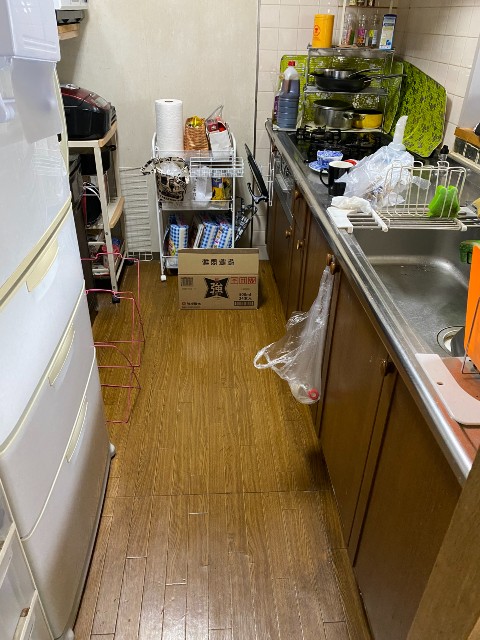
You are a GUI agent. You are given a task and a screenshot of the screen. Output one action in this format:
    pyautogui.click(x=<x>, y=<y>)
    Task: Click on the paper towels
    
    Given the screenshot: What is the action you would take?
    pyautogui.click(x=162, y=123)